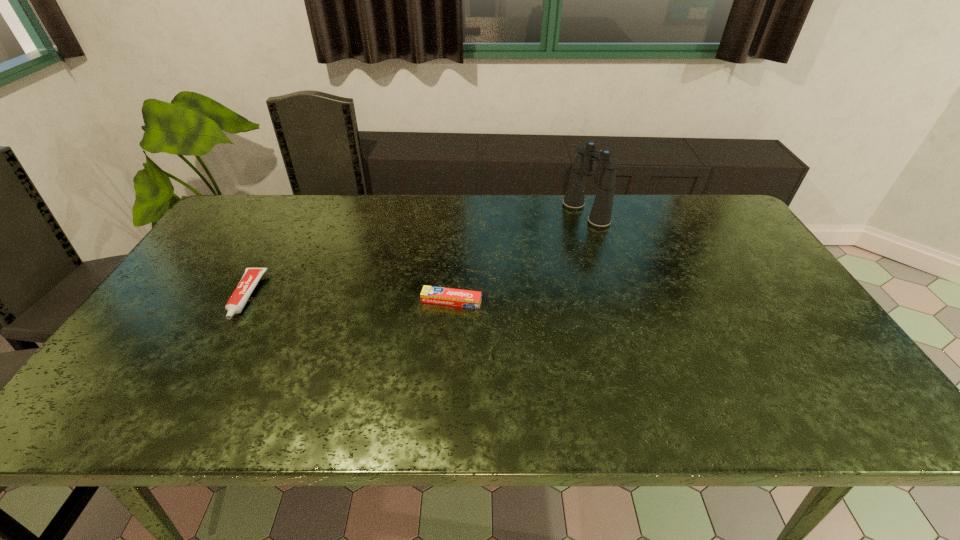
Image resolution: width=960 pixels, height=540 pixels. In order to click on empty location between the farthest object and the second object from left to right in this screenshot , I will do pos(518,257).

The width and height of the screenshot is (960, 540). Find the location of `vacant area between the left toothpaste and the shortest object`. vacant area between the left toothpaste and the shortest object is located at coordinates (348, 299).

This screenshot has width=960, height=540. In order to click on vacant point located between the leftmost object and the second object from right to left in this screenshot , I will do point(348,299).

Locate an element on the screen. The width and height of the screenshot is (960, 540). free space that is in between the leftmost object and the shortest object is located at coordinates (348, 299).

Locate which object is the closest to the shorter toothpaste. Please provide its 2D coordinates. Your answer should be formatted as a tuple, i.e. [(x, y)], where the tuple contains the x and y coordinates of a point satisfying the conditions above.

[(600, 216)]

Locate which object is the second closest to the leftmost object. Please provide its 2D coordinates. Your answer should be formatted as a tuple, i.e. [(x, y)], where the tuple contains the x and y coordinates of a point satisfying the conditions above.

[(600, 216)]

Find the location of a particular element. The height and width of the screenshot is (540, 960). free space that satisfies the following two spatial constraints: 1. at the nozzle of the shortest object; 2. on the right side of the leftmost object is located at coordinates (244, 301).

Locate an element on the screen. This screenshot has height=540, width=960. free space that satisfies the following two spatial constraints: 1. on the back side of the shorter toothpaste; 2. on the left side of the binoculars is located at coordinates (457, 213).

I want to click on free spot that satisfies the following two spatial constraints: 1. at the nozzle of the second object from left to right; 2. on the left side of the leftmost object, so click(x=244, y=301).

Where is `blank area in the image that satisfies the following two spatial constraints: 1. at the nozzle of the second tallest object; 2. on the right side of the shorter toothpaste`? blank area in the image that satisfies the following two spatial constraints: 1. at the nozzle of the second tallest object; 2. on the right side of the shorter toothpaste is located at coordinates (244, 301).